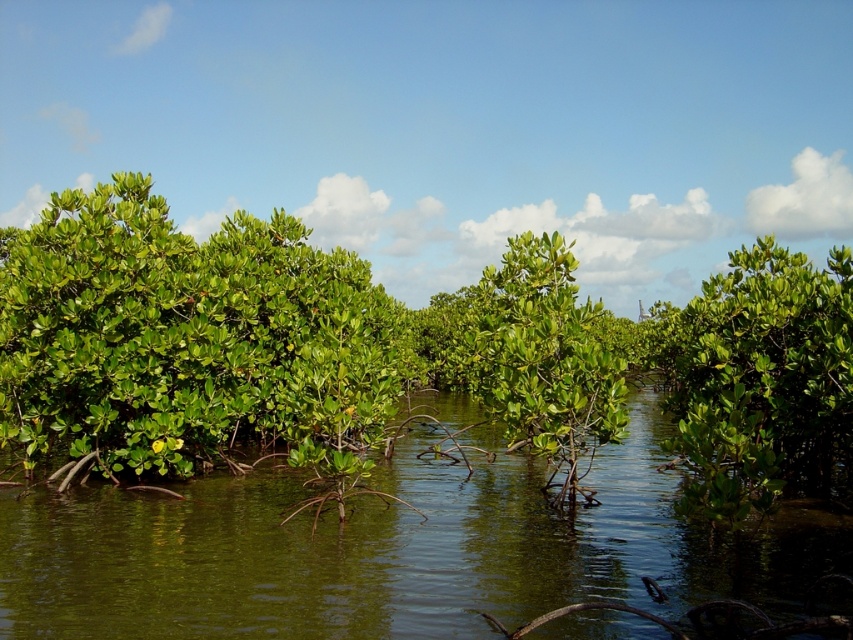
You are a bird looking for a nesting spot in the mangrove forest. You see the green leafy mangrove at center and the green leafy plant at center. Which one is taller and would provide a better vantage point?

The green leafy mangrove at center is much taller than the green leafy plant at center, so it would provide a better vantage point for nesting.

You are a bird flying over the mangrove forest. You see the green leafy vegetation at center and the green leafy bush at left. Which one is closer to the water surface?

The green leafy vegetation at center is located below the green leafy bush at left, so it is closer to the water surface.